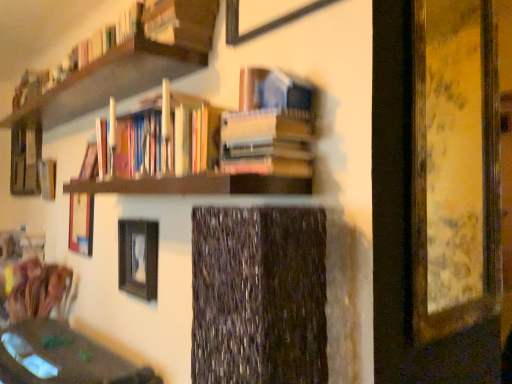
Question: Is hardcover book at center, marked as the 3th book in a top-to-bottom arrangement, in front of or behind wooden swivel chair at lower left in the image?

Choices:
 (A) behind
 (B) front

Answer: (B)

Question: From the image's perspective, is hardcover book at center, which appears as the first book when ordered from the bottom, located above or below wooden swivel chair at lower left?

Choices:
 (A) below
 (B) above

Answer: (B)

Question: Which object is the closest to the wooden swivel chair at lower left?

Choices:
 (A) wooden bookshelf at left
 (B) wooden picture frame at right, marked as the first picture frame in a right-to-left arrangement
 (C) wooden bookshelf at upper left, which ranks as the 1th book in top-to-bottom order
 (D) hardcover books at center, positioned as the second book in bottom-to-top order
 (E) matte black picture frame at center, which is counted as the second picture frame, starting from the back

Answer: (E)

Question: Which is farther from the wooden bookshelf at left?

Choices:
 (A) wooden picture frame at center, which ranks as the 4th picture frame in right-to-left order
 (B) wooden frame at upper center, marked as the third picture frame in a left-to-right arrangement
 (C) hardcover books at center, which is the second book in top-to-bottom order
 (D) wooden picture frame at right, which ranks as the 3th picture frame in back-to-front order
 (E) hardcover book at center, which appears as the first book when ordered from the bottom

Answer: (D)